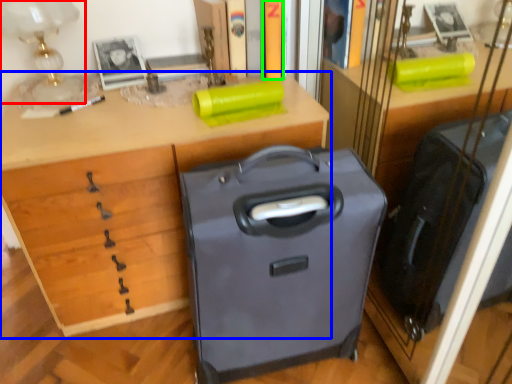
Question: Estimate the real-world distances between objects in this image. Which object is closer to table lamp (highlighted by a red box), desk (highlighted by a blue box) or book (highlighted by a green box)?

Choices:
 (A) desk
 (B) book

Answer: (A)